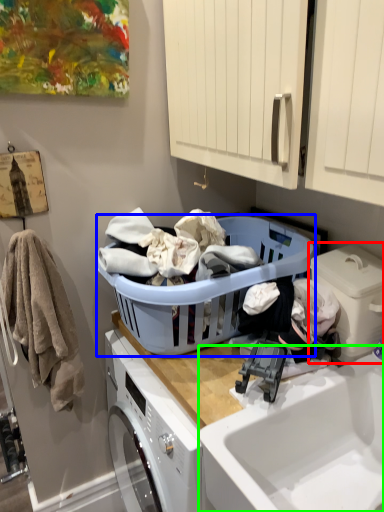
Question: Which object is positioned closest to washing machine (highlighted by a red box)? Select from laundry basket (highlighted by a blue box) and sink (highlighted by a green box).

Choices:
 (A) laundry basket
 (B) sink

Answer: (B)